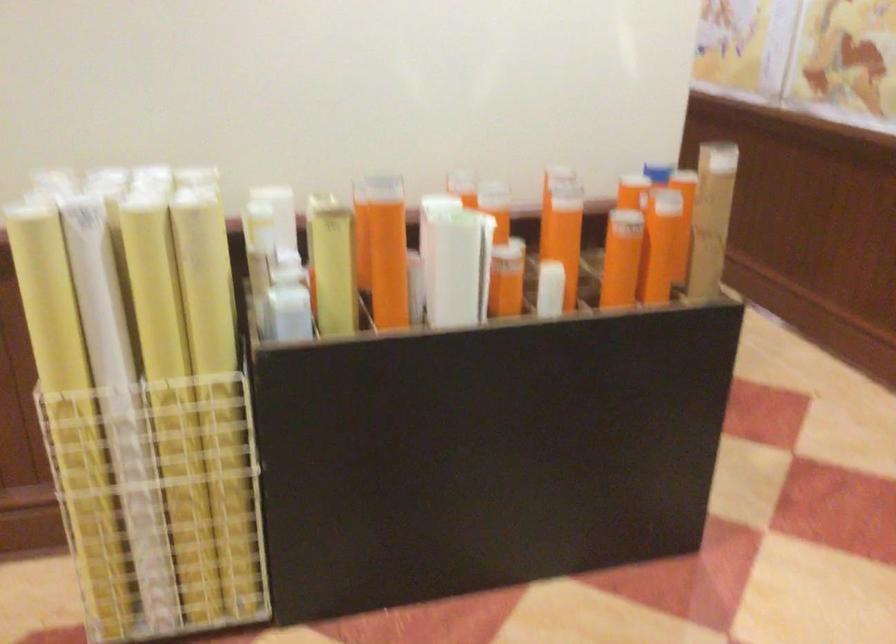
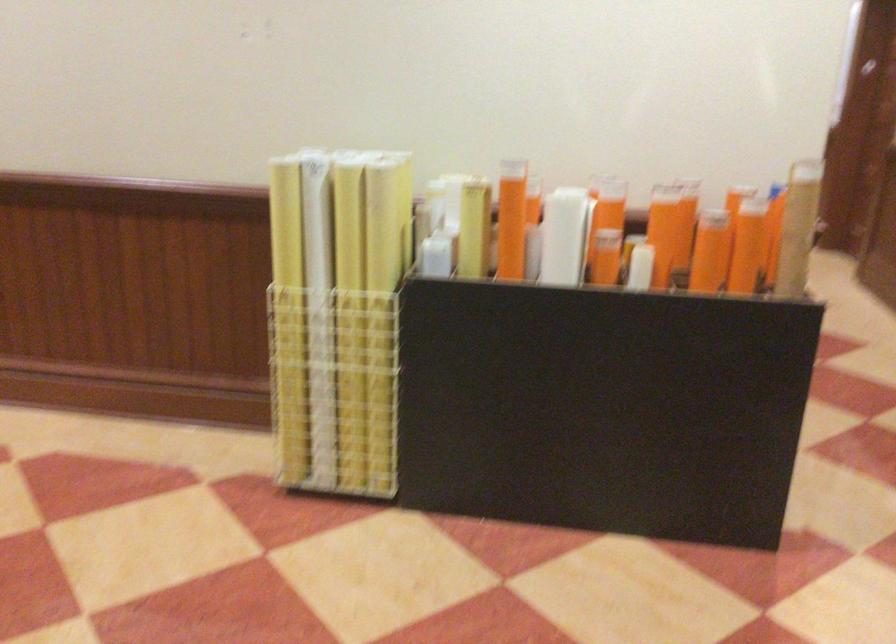
In the second image, find the point that corresponds to point (625, 258) in the first image.

(710, 251)